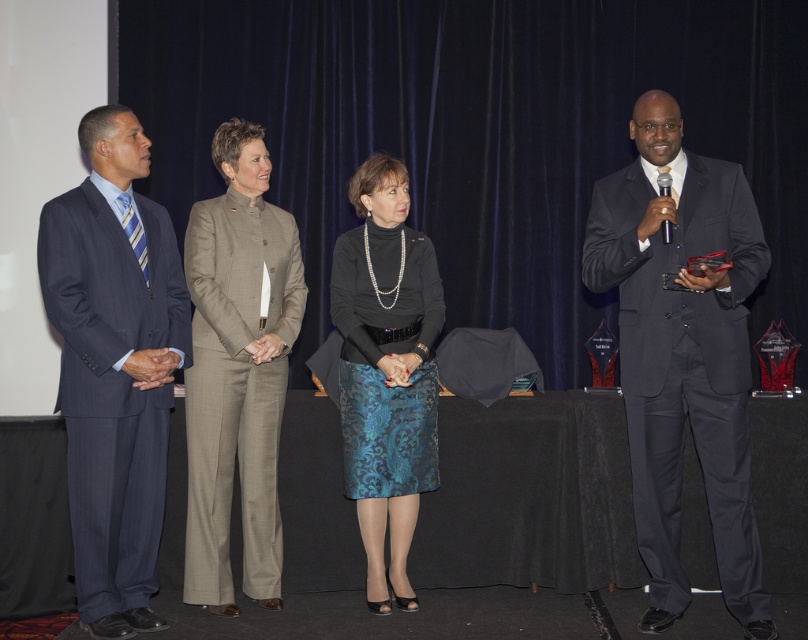
Question: Is matte black suit at right further to camera compared to beige woolen suit at center?

Choices:
 (A) no
 (B) yes

Answer: (A)

Question: Estimate the real-world distances between objects in this image. Which object is farther from the matte black blouse at center?

Choices:
 (A) beige woolen suit at center
 (B) matte black suit at right
 (C) dark blue pinstripe suit at left

Answer: (B)

Question: Can you confirm if dark blue pinstripe suit at left is smaller than beige woolen suit at center?

Choices:
 (A) yes
 (B) no

Answer: (B)

Question: Is matte black suit at right below beige woolen suit at center?

Choices:
 (A) yes
 (B) no

Answer: (B)

Question: Which is nearer to the matte black suit at right?

Choices:
 (A) beige woolen suit at center
 (B) matte black blouse at center
 (C) dark blue pinstripe suit at left

Answer: (B)

Question: Which point appears closest to the camera in this image?

Choices:
 (A) (372, 358)
 (B) (152, 493)
 (C) (243, 330)

Answer: (B)